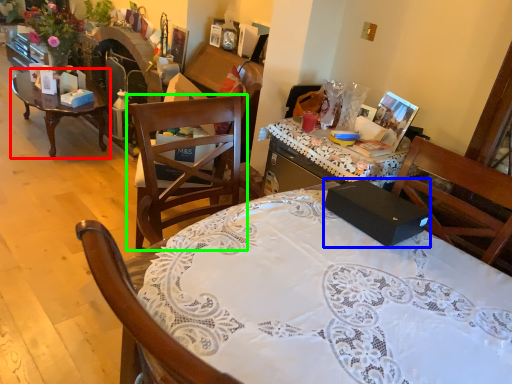
Question: Which object is positioned closest to coffee table (highlighted by a red box)? Select from box (highlighted by a blue box) and chair (highlighted by a green box).

Choices:
 (A) box
 (B) chair

Answer: (B)